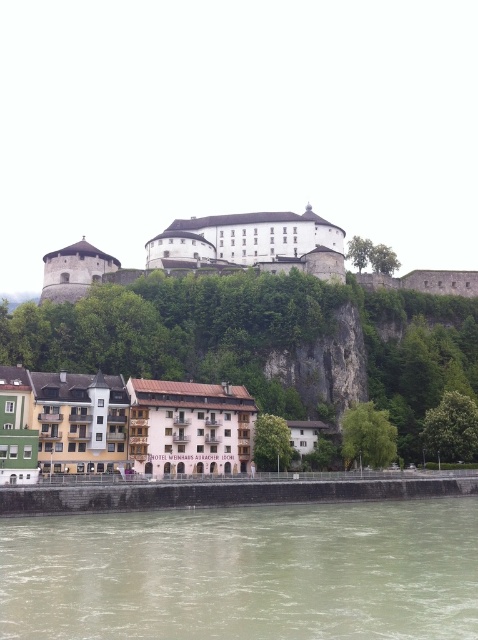
Is brown sedimentary rock at lower center to the right of multicolored painted buildings at lower center from the viewer's perspective?

Yes, brown sedimentary rock at lower center is to the right of multicolored painted buildings at lower center.

Which is in front, point (57, 554) or point (118, 419)?

Point (57, 554)

Locate an element on the screen. Image resolution: width=478 pixels, height=640 pixels. brown sedimentary rock at lower center is located at coordinates (245, 572).